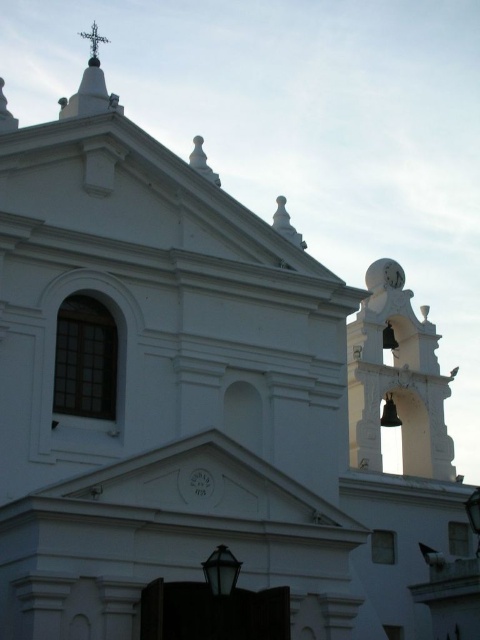
Question: Is the position of white metallic bell tower at upper right more distant than that of white stone cross at upper center?

Choices:
 (A) yes
 (B) no

Answer: (A)

Question: Which object is positioned closest to the white stone cross at upper center?

Choices:
 (A) white glossy clock at center
 (B) white metallic bell tower at upper right

Answer: (B)

Question: Is white glossy clock at center to the left of white stone cross at upper center from the viewer's perspective?

Choices:
 (A) no
 (B) yes

Answer: (A)

Question: Which of the following is the farthest from the observer?

Choices:
 (A) white stone cross at upper center
 (B) white glossy clock at center

Answer: (A)

Question: Can you confirm if white metallic bell tower at upper right is smaller than white glossy clock at center?

Choices:
 (A) yes
 (B) no

Answer: (B)

Question: Which point is closer to the camera?

Choices:
 (A) white metallic bell tower at upper right
 (B) white stone cross at upper center
 (C) white glossy clock at center

Answer: (C)